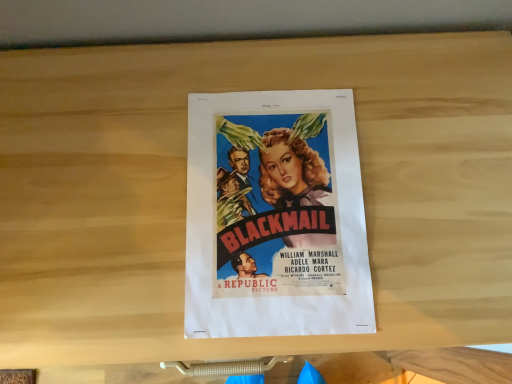
The image size is (512, 384). What do you see at coordinates (275, 216) in the screenshot?
I see `matte paper poster at center` at bounding box center [275, 216].

You are a GUI agent. You are given a task and a screenshot of the screen. Output one action in this format:
    pyautogui.click(x=<x>, y=<y>)
    Task: Click on the matte paper poster at center
    The height and width of the screenshot is (384, 512).
    Given the screenshot: What is the action you would take?
    pyautogui.click(x=275, y=216)

Where is `matte paper poster at center`? matte paper poster at center is located at coordinates (275, 216).